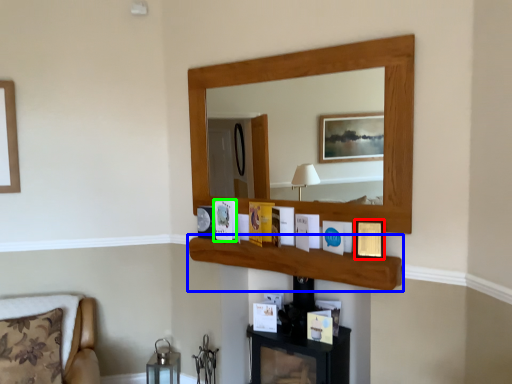
Question: Which object is positioned farthest from picture frame (highlighted by a red box)? Select from cabinet (highlighted by a blue box) and picture frame (highlighted by a green box).

Choices:
 (A) cabinet
 (B) picture frame

Answer: (B)